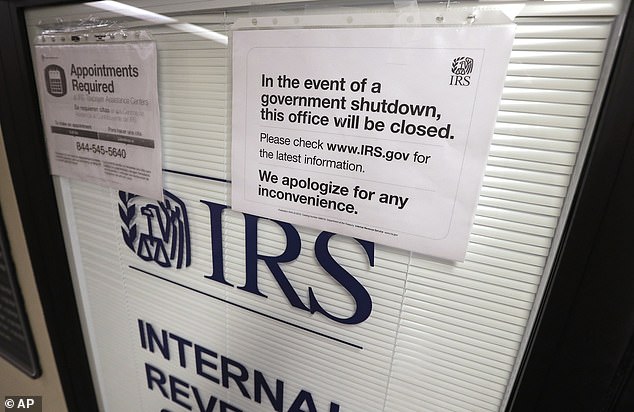
At what (x,y) coordinates should I click in order to perform the action: click on caculator. Please return your answer as a coordinate pair (x, y). This screenshot has height=412, width=634. Looking at the image, I should click on (52, 81).